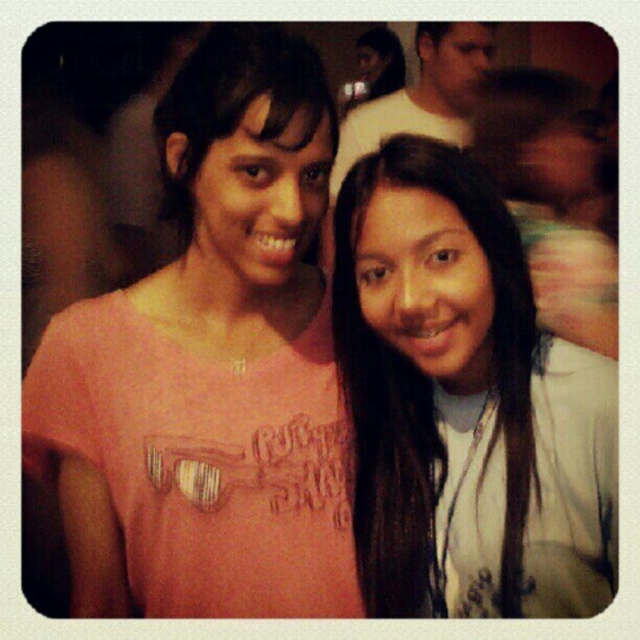
Question: Which point is closer to the camera?

Choices:
 (A) white matte hair at center
 (B) matte white shirt at upper center

Answer: (A)

Question: Observing the image, what is the correct spatial positioning of white matte hair at center in reference to matte white shirt at upper center?

Choices:
 (A) left
 (B) right

Answer: (A)

Question: Does white matte hair at center have a smaller size compared to matte white shirt at upper center?

Choices:
 (A) no
 (B) yes

Answer: (B)

Question: Can you confirm if pink matte t-shirt at center is positioned to the left of white matte hair at center?

Choices:
 (A) yes
 (B) no

Answer: (A)

Question: Which object is the farthest from the white matte hair at center?

Choices:
 (A) pink matte t-shirt at center
 (B) matte white shirt at upper center

Answer: (B)

Question: Among these points, which one is farthest from the camera?

Choices:
 (A) (401, 211)
 (B) (435, 136)
 (C) (70, 444)

Answer: (B)